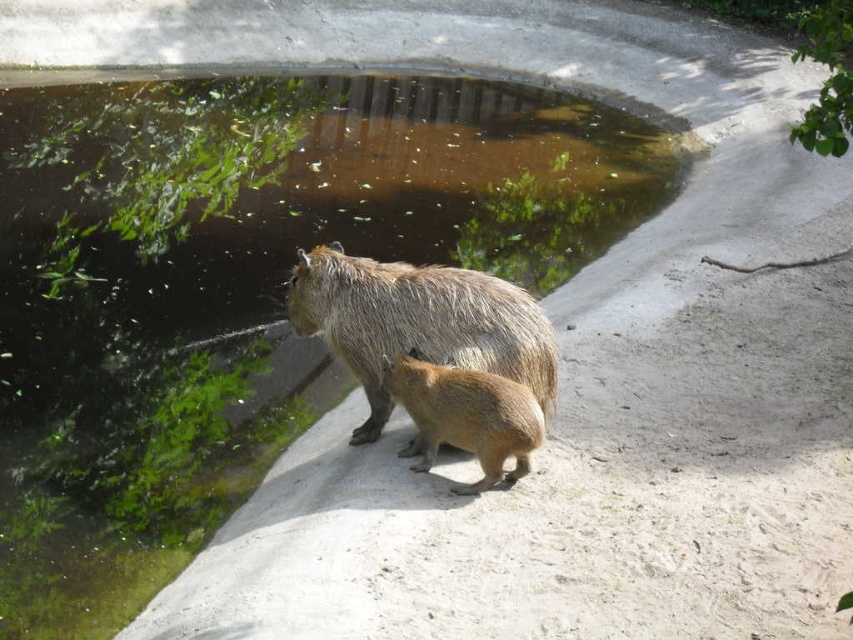
Question: Is green mossy water at center to the right of brown furry capybara at center from the viewer's perspective?

Choices:
 (A) no
 (B) yes

Answer: (A)

Question: Can you confirm if fuzzy brown capybara at center is positioned below brown furry capybara at center?

Choices:
 (A) no
 (B) yes

Answer: (A)

Question: Which of the following is the closest to the observer?

Choices:
 (A) (412, 358)
 (B) (129, 188)
 (C) (409, 268)

Answer: (A)

Question: Considering the relative positions of green mossy water at center and fuzzy brown capybara at center in the image provided, where is green mossy water at center located with respect to fuzzy brown capybara at center?

Choices:
 (A) right
 (B) left

Answer: (B)

Question: Which point is farther from the camera taking this photo?

Choices:
 (A) (424, 432)
 (B) (670, 176)

Answer: (B)

Question: Which point is closer to the camera?

Choices:
 (A) green mossy water at center
 (B) fuzzy brown capybara at center

Answer: (B)